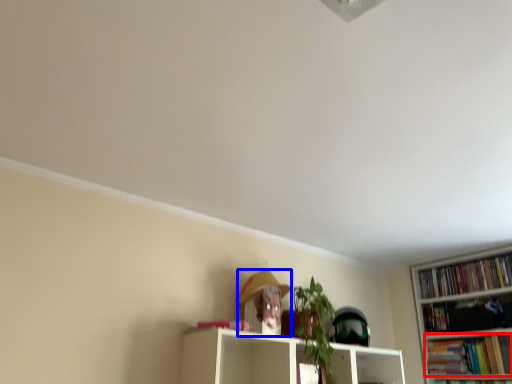
Question: Among these objects, which one is nearest to the camera, book (highlighted by a red box) or person (highlighted by a blue box)?

Choices:
 (A) book
 (B) person

Answer: (B)